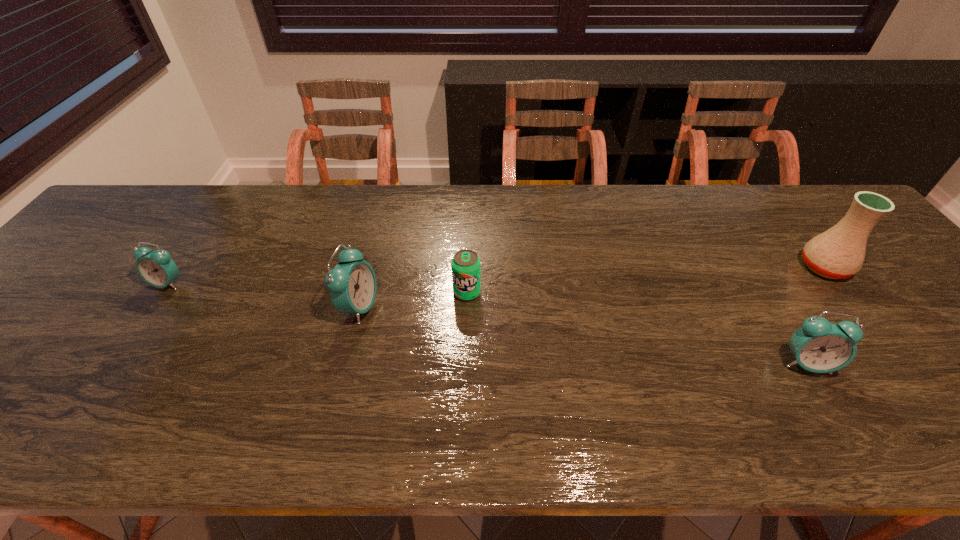
The width and height of the screenshot is (960, 540). What are the coordinates of `the leftmost alarm clock` in the screenshot? It's located at (156, 268).

Where is `the leftmost object`? This screenshot has height=540, width=960. the leftmost object is located at coordinates [x=156, y=268].

This screenshot has height=540, width=960. Find the location of `the second alarm clock from right to left`. the second alarm clock from right to left is located at coordinates (352, 283).

What are the coordinates of `the rightmost alarm clock` in the screenshot? It's located at (819, 346).

You are a GUI agent. You are given a task and a screenshot of the screen. Output one action in this format:
    pyautogui.click(x=<x>, y=<y>)
    Task: Click on the third tallest object
    
    Given the screenshot: What is the action you would take?
    pyautogui.click(x=819, y=346)

The image size is (960, 540). What are the coordinates of `the tallest object` in the screenshot? It's located at (838, 253).

At what (x,y) coordinates should I click in order to perform the action: click on pottery. Please return your answer as a coordinate pair (x, y). The width and height of the screenshot is (960, 540). Looking at the image, I should click on (838, 253).

At what (x,y) coordinates should I click in order to perform the action: click on the third object from right to left. Please return your answer as a coordinate pair (x, y). Looking at the image, I should click on (466, 267).

Locate an element on the screen. vacant space located 0.210m on the face of the shortest alarm clock is located at coordinates (114, 364).

At what (x,y) coordinates should I click in order to perform the action: click on blank space located 0.130m on the face of the second object from left to right. Please return your answer as a coordinate pair (x, y). Looking at the image, I should click on (431, 307).